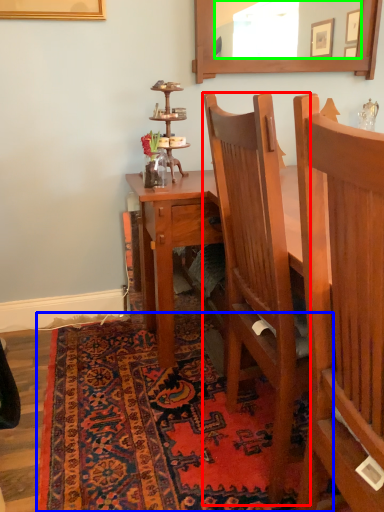
Question: Estimate the real-world distances between objects in this image. Which object is closer to chair (highlighted by a red box), mat (highlighted by a blue box) or mirror (highlighted by a green box)?

Choices:
 (A) mat
 (B) mirror

Answer: (A)